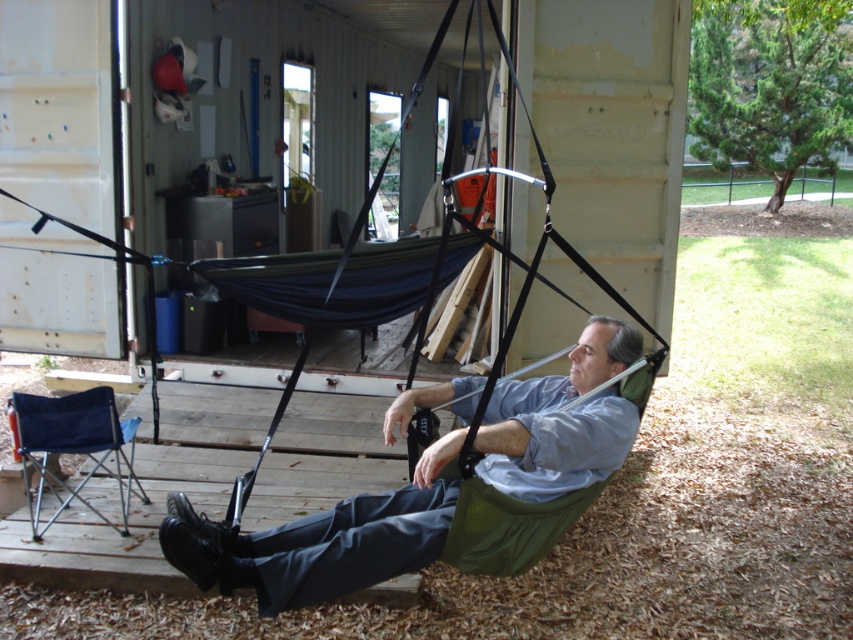
Question: Can you confirm if green fabric hammock at center is positioned above blue fabric folding chair at lower left?

Choices:
 (A) yes
 (B) no

Answer: (A)

Question: Does green fabric hammock at center come behind blue fabric folding chair at lower left?

Choices:
 (A) no
 (B) yes

Answer: (A)

Question: Does green fabric hammock at center appear under blue fabric folding chair at lower left?

Choices:
 (A) no
 (B) yes

Answer: (A)

Question: Which point is closer to the camera?

Choices:
 (A) (415, 392)
 (B) (131, 448)

Answer: (A)